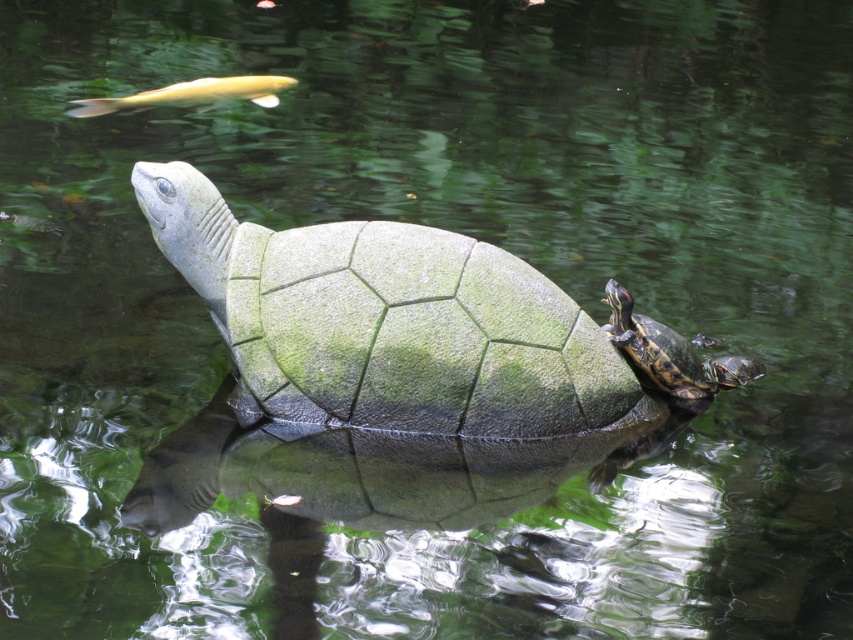
Question: Does shiny brown tortoise at upper right appear under golden smooth fish at upper left?

Choices:
 (A) no
 (B) yes

Answer: (B)

Question: Where is shiny brown tortoise at upper right located in relation to golden smooth fish at upper left in the image?

Choices:
 (A) right
 (B) left

Answer: (A)

Question: Which object appears farthest from the camera in this image?

Choices:
 (A) golden smooth fish at upper left
 (B) green mossy tortoise at center

Answer: (A)

Question: Which point appears farthest from the camera in this image?

Choices:
 (A) (714, 390)
 (B) (173, 179)

Answer: (A)

Question: Is the position of green mossy tortoise at center less distant than that of golden smooth fish at upper left?

Choices:
 (A) no
 (B) yes

Answer: (B)

Question: Which point is farther to the camera?

Choices:
 (A) (410, 372)
 (B) (752, 364)

Answer: (B)